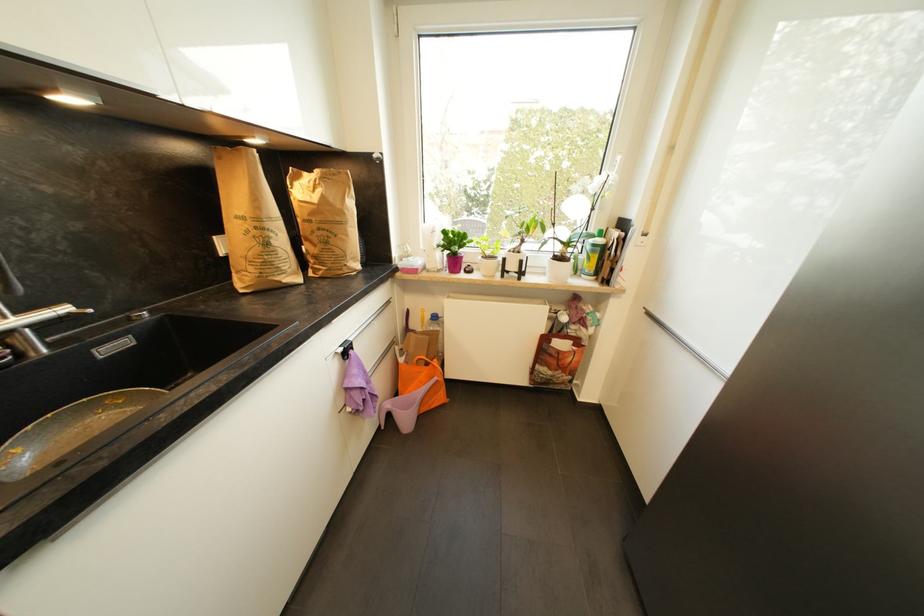
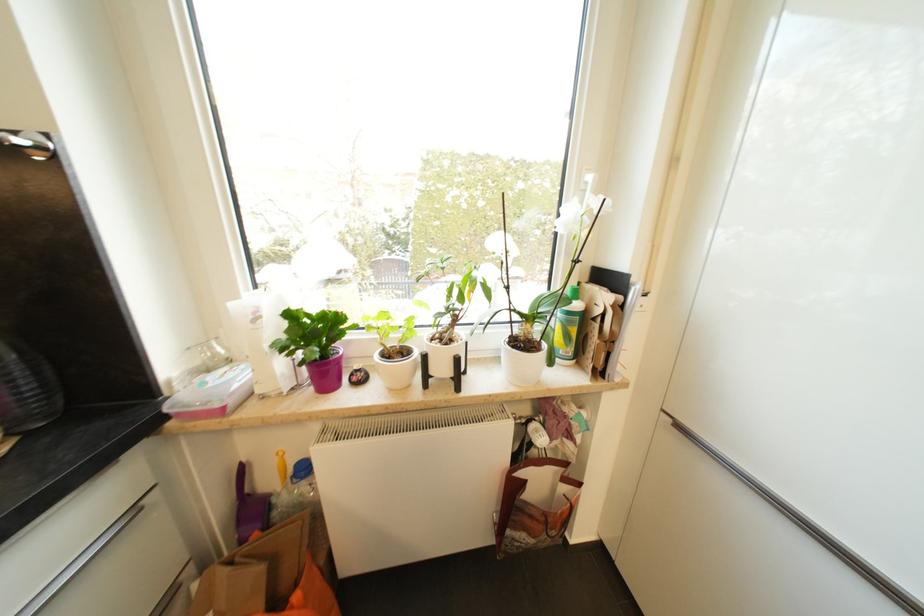
Find the pixel in the second image that matches the point at 599,246 in the first image.

(574, 315)